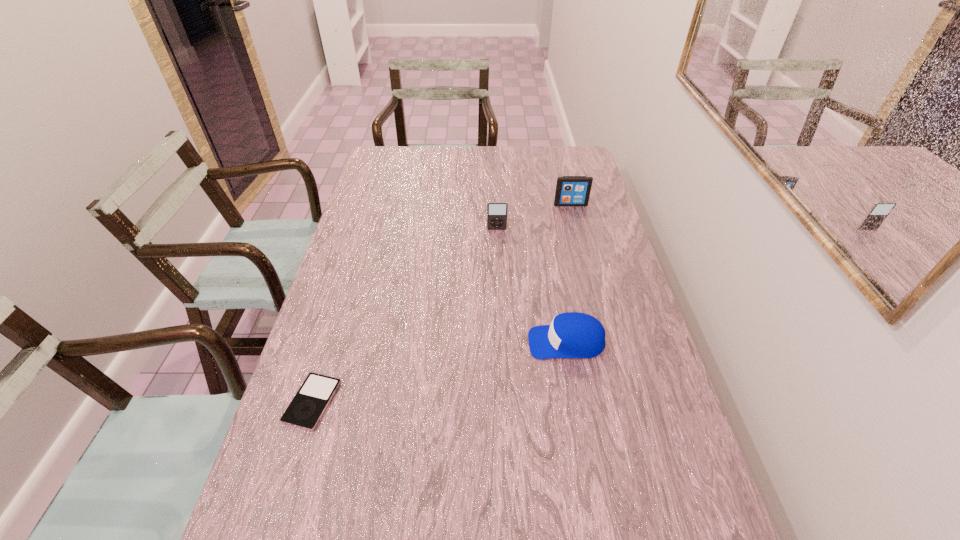
In order to click on free space between the third farthest object and the farthest iPod in this screenshot , I will do `click(568, 273)`.

Identify which object is the third closest to the farthest iPod. Please provide its 2D coordinates. Your answer should be formatted as a tuple, i.e. [(x, y)], where the tuple contains the x and y coordinates of a point satisfying the conditions above.

[(310, 402)]

I want to click on object that is the closest to the second iPod from left to right, so 570,190.

Find the location of a particular element. This screenshot has width=960, height=540. the closest iPod relative to the second object from left to right is located at coordinates (570, 190).

You are a GUI agent. You are given a task and a screenshot of the screen. Output one action in this format:
    pyautogui.click(x=<x>, y=<y>)
    Task: Click on the iPod that can be found as the closest to the second shortest object
    This screenshot has height=540, width=960.
    Given the screenshot: What is the action you would take?
    pyautogui.click(x=496, y=211)

You are a GUI agent. You are given a task and a screenshot of the screen. Output one action in this format:
    pyautogui.click(x=<x>, y=<y>)
    Task: Click on the blank space that satisfies the following two spatial constraints: 1. on the front screen of the farthest iPod; 2. on the front-facing side of the second nearest object
    Image resolution: width=960 pixels, height=540 pixels.
    Given the screenshot: What is the action you would take?
    pyautogui.click(x=606, y=342)

Image resolution: width=960 pixels, height=540 pixels. I want to click on vacant area in the image that satisfies the following two spatial constraints: 1. on the front screen of the farthest iPod; 2. on the front-facing side of the third farthest object, so click(x=606, y=342).

This screenshot has width=960, height=540. I want to click on vacant space that satisfies the following two spatial constraints: 1. on the front screen of the farthest object; 2. on the front-facing side of the baseball cap, so click(x=606, y=342).